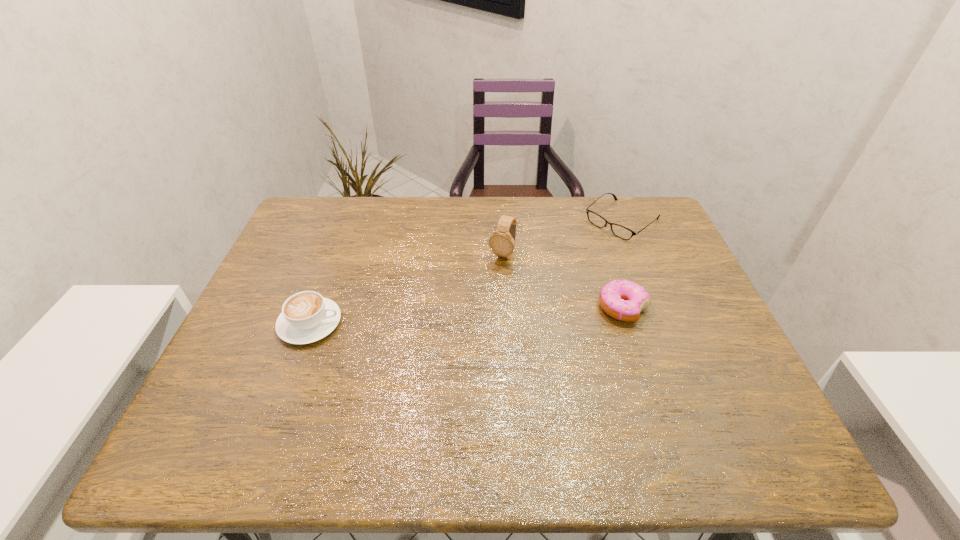
The width and height of the screenshot is (960, 540). What are the coordinates of `vacant area that lies between the shortest object and the leftmost object` in the screenshot? It's located at (466, 272).

The height and width of the screenshot is (540, 960). In order to click on vacant area that lies between the tallest object and the shortest object in this screenshot , I will do `click(562, 238)`.

You are a GUI agent. You are given a task and a screenshot of the screen. Output one action in this format:
    pyautogui.click(x=<x>, y=<y>)
    Task: Click on the blank region between the third tallest object and the spectacles
    The image size is (960, 540).
    Given the screenshot: What is the action you would take?
    pyautogui.click(x=622, y=264)

Where is `free space between the spectacles and the leftmost object`? free space between the spectacles and the leftmost object is located at coordinates (466, 272).

This screenshot has width=960, height=540. In order to click on unoccupied area between the second object from left to right and the second shortest object in this screenshot , I will do `click(563, 281)`.

This screenshot has height=540, width=960. In order to click on the third closest object to the tallest object in this screenshot , I will do `click(306, 317)`.

Identify which object is the third nearest to the third object from right to left. Please provide its 2D coordinates. Your answer should be formatted as a tuple, i.e. [(x, y)], where the tuple contains the x and y coordinates of a point satisfying the conditions above.

[(306, 317)]